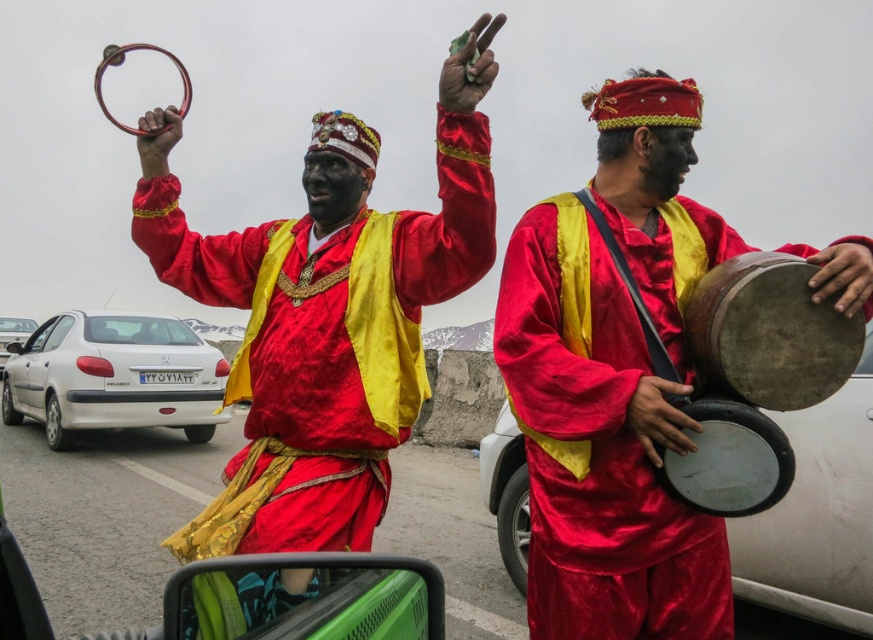
You are a photographer standing in front of the white matte sedan at lower left. You want to take a photo of the satin red drum at right without any obstructions. Since the drum is taller than the sedan, will the sedan block the view of the drum?

The satin red drum at right is taller than the white matte sedan at lower left, so the sedan will not block the view of the drum as the drum extends higher than the sedan.

You are a photographer standing in the street and want to take a photo of the satin red vest at upper center and the white glossy sedan at left. Based on their positions, which object is closer to the right side of the photo frame?

The satin red vest at upper center is positioned on the right side of the white glossy sedan at left, so it is closer to the right side of the photo frame.

You are a photographer trying to capture a photo of the satin red drum at right and the white matte sedan at lower left. From the photographer perspective, which object is closer to the right edge of the frame?

The satin red drum at right is positioned on the right side of white matte sedan at lower left, so the satin red drum at right is closer to the right edge of the frame.